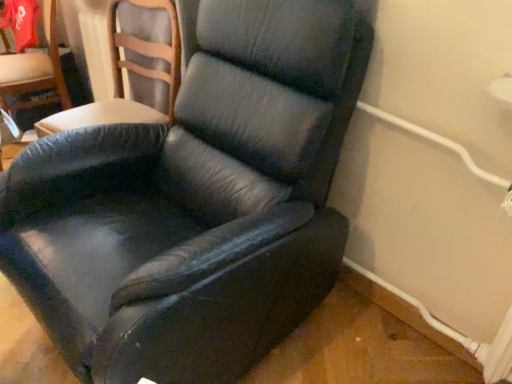
Question: In which direction should I rotate to look at black leather chair at center, the 2th chair viewed from the right?

Choices:
 (A) left
 (B) right

Answer: (A)

Question: Is the depth of black leather chair at center, positioned as the 1th chair in right-to-left order, greater than that of black leather chair at center, acting as the 1th chair starting from the left?

Choices:
 (A) yes
 (B) no

Answer: (B)

Question: From the image's perspective, does black leather chair at center, which ranks as the 2th chair in left-to-right order, appear higher than black leather chair at center, the 2th chair viewed from the right?

Choices:
 (A) no
 (B) yes

Answer: (A)

Question: Is black leather chair at center, positioned as the 1th chair in right-to-left order, outside of black leather chair at center, acting as the 1th chair starting from the left?

Choices:
 (A) yes
 (B) no

Answer: (A)

Question: Does black leather chair at center, positioned as the 1th chair in right-to-left order, appear on the left side of black leather chair at center, the 2th chair viewed from the right?

Choices:
 (A) no
 (B) yes

Answer: (A)

Question: Does black leather chair at center, positioned as the 1th chair in right-to-left order, have a greater height compared to black leather chair at center, acting as the 1th chair starting from the left?

Choices:
 (A) yes
 (B) no

Answer: (A)

Question: Is black leather chair at center, positioned as the 1th chair in right-to-left order, at the right side of black leather chair at center, the 2th chair viewed from the right?

Choices:
 (A) no
 (B) yes

Answer: (B)

Question: From a real-world perspective, does black leather chair at center, the 2th chair viewed from the right, sit lower than black leather chair at center, positioned as the 1th chair in right-to-left order?

Choices:
 (A) yes
 (B) no

Answer: (B)

Question: Would you say black leather chair at center, positioned as the 1th chair in right-to-left order, is part of black leather chair at center, acting as the 1th chair starting from the left,'s contents?

Choices:
 (A) no
 (B) yes

Answer: (A)

Question: Considering the relative positions of black leather chair at center, the 2th chair viewed from the right, and black leather chair at center, which ranks as the 2th chair in left-to-right order, in the image provided, is black leather chair at center, the 2th chair viewed from the right, behind black leather chair at center, which ranks as the 2th chair in left-to-right order,?

Choices:
 (A) yes
 (B) no

Answer: (A)

Question: Considering the relative sizes of black leather chair at center, the 2th chair viewed from the right, and black leather chair at center, which ranks as the 2th chair in left-to-right order, in the image provided, is black leather chair at center, the 2th chair viewed from the right, bigger than black leather chair at center, which ranks as the 2th chair in left-to-right order,?

Choices:
 (A) yes
 (B) no

Answer: (B)

Question: Is black leather chair at center, the 2th chair viewed from the right, facing away from black leather chair at center, which ranks as the 2th chair in left-to-right order?

Choices:
 (A) yes
 (B) no

Answer: (B)

Question: Does black leather chair at center, acting as the 1th chair starting from the left, appear on the right side of black leather chair at center, which ranks as the 2th chair in left-to-right order?

Choices:
 (A) yes
 (B) no

Answer: (B)

Question: In terms of width, does black leather chair at center, which ranks as the 2th chair in left-to-right order, look wider or thinner when compared to black leather chair at center, acting as the 1th chair starting from the left?

Choices:
 (A) thin
 (B) wide

Answer: (B)